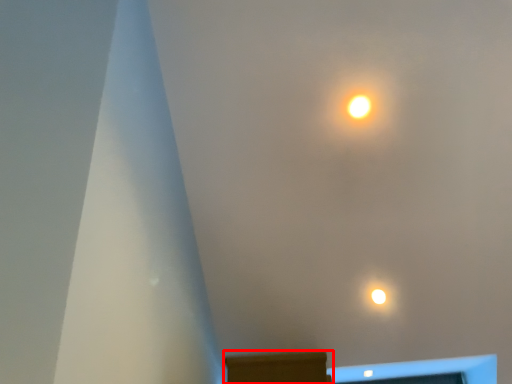
Question: Where is furniture (annotated by the red box) located in relation to lamp in the image?

Choices:
 (A) left
 (B) right

Answer: (A)